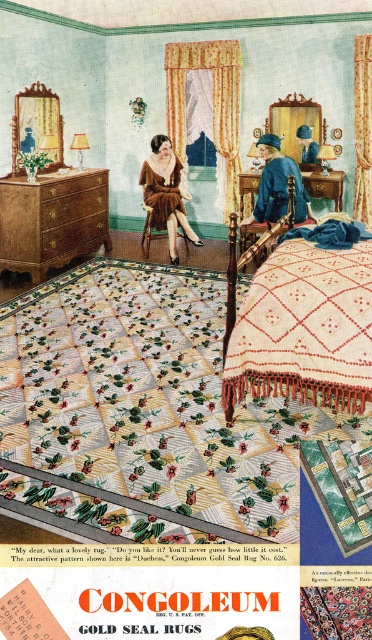
The image size is (372, 640). What do you see at coordinates (52, 220) in the screenshot? I see `wooden dresser at left` at bounding box center [52, 220].

Is wooden dresser at left smaller than blue velvet dress at center?

No, wooden dresser at left is not smaller than blue velvet dress at center.

Which is in front, point (8, 177) or point (264, 154)?

Positioned in front is point (264, 154).

The width and height of the screenshot is (372, 640). Identify the location of wooden dresser at left. (52, 220).

Can you confirm if printed cotton quilt at center is positioned to the right of wooden dresser at left?

Yes, printed cotton quilt at center is to the right of wooden dresser at left.

Who is shorter, printed cotton quilt at center or wooden dresser at left?

printed cotton quilt at center

This screenshot has width=372, height=640. Describe the element at coordinates (149, 397) in the screenshot. I see `printed cotton quilt at center` at that location.

In order to click on printed cotton quilt at center in this screenshot , I will do `click(149, 397)`.

The height and width of the screenshot is (640, 372). What do you see at coordinates (305, 328) in the screenshot?
I see `white knitted blanket at center` at bounding box center [305, 328].

In the scene shown: Can you confirm if white knitted blanket at center is positioned above blue velvet dress at center?

No, white knitted blanket at center is not above blue velvet dress at center.

Between point (312, 298) and point (270, 136), which one is positioned behind?

The point (270, 136) is more distant.

At what (x,y) coordinates should I click in order to perform the action: click on white knitted blanket at center. Please return your answer as a coordinate pair (x, y). The height and width of the screenshot is (640, 372). Looking at the image, I should click on (305, 328).